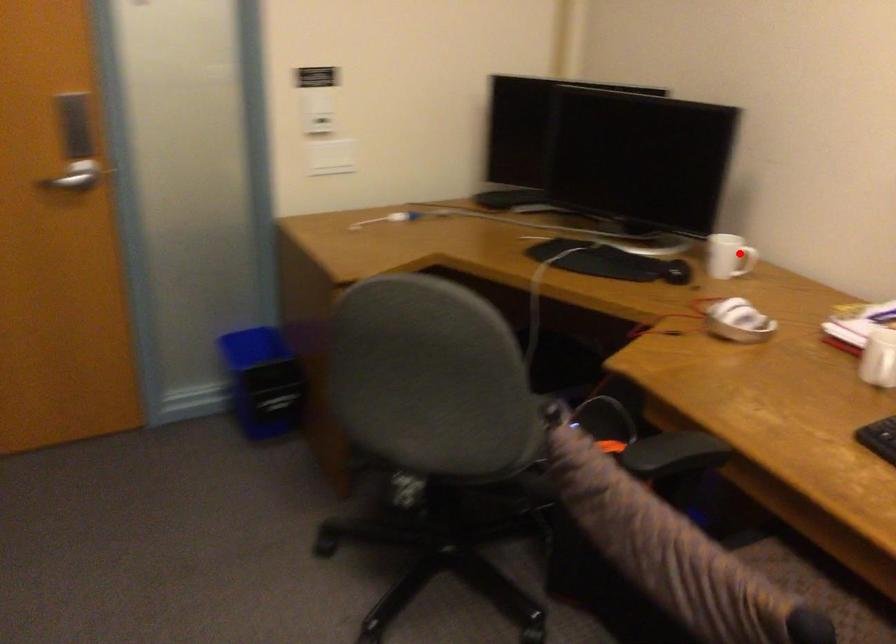
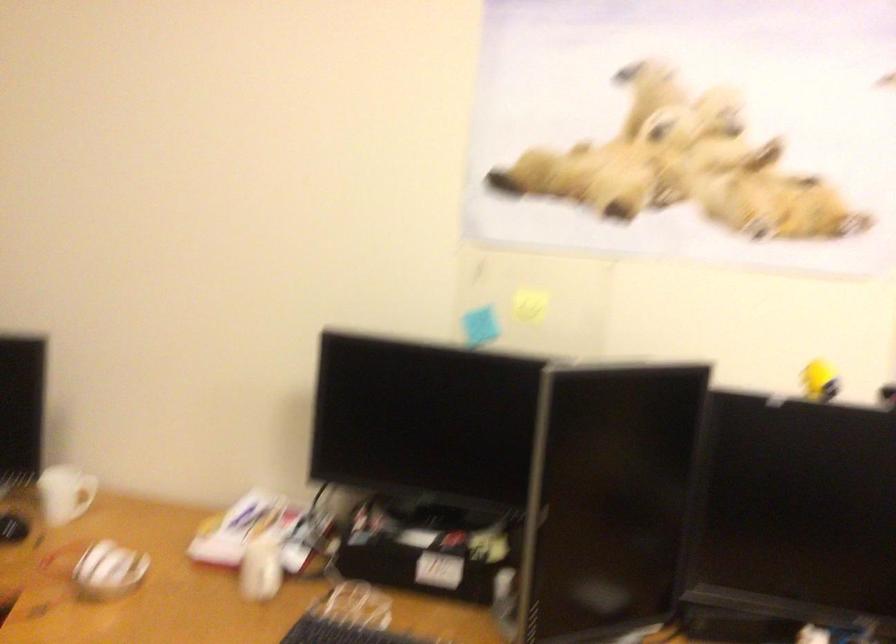
The point at the highlighted location is marked in the first image. Where is the corresponding point in the second image?

(83, 495)